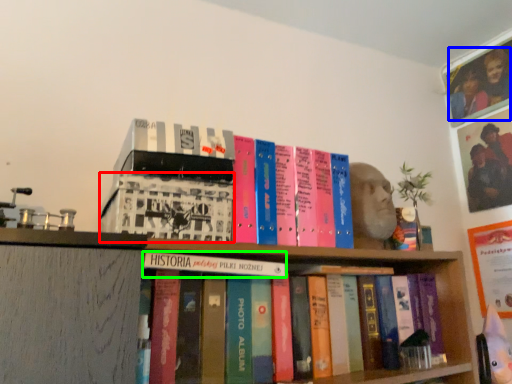
Question: Which object is positioned farthest from book (highlighted by a red box)? Select from couple (highlighted by a blue box) and book (highlighted by a green box).

Choices:
 (A) couple
 (B) book

Answer: (A)